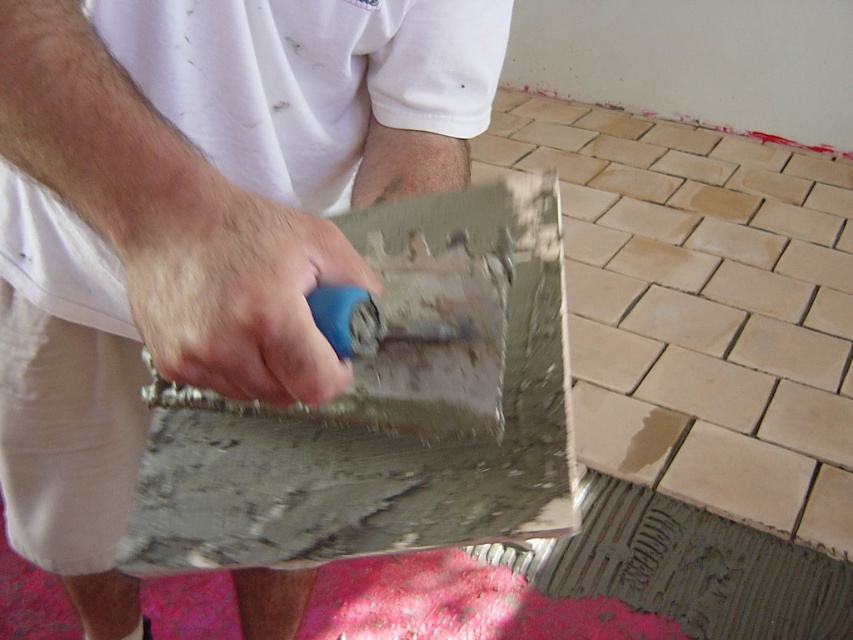
Question: Can you confirm if smooth concrete trowel at center is positioned below blue plastic trowel at center?

Choices:
 (A) yes
 (B) no

Answer: (A)

Question: Estimate the real-world distances between objects in this image. Which object is closer to the smooth concrete trowel at center?

Choices:
 (A) gray matte cement at lower right
 (B) blue plastic trowel at center

Answer: (B)

Question: Which object is positioned closest to the gray matte cement at lower right?

Choices:
 (A) blue plastic trowel at center
 (B) smooth concrete trowel at center

Answer: (B)

Question: Is smooth concrete trowel at center positioned before blue plastic trowel at center?

Choices:
 (A) yes
 (B) no

Answer: (A)

Question: Can you confirm if gray matte cement at lower right is positioned to the right of blue plastic trowel at center?

Choices:
 (A) no
 (B) yes

Answer: (B)

Question: Which object appears farthest from the camera in this image?

Choices:
 (A) blue plastic trowel at center
 (B) gray matte cement at lower right
 (C) smooth concrete trowel at center

Answer: (B)